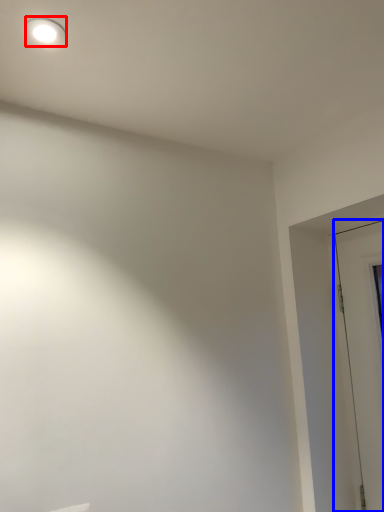
Question: Among these objects, which one is nearest to the camera, lighting (highlighted by a red box) or door (highlighted by a blue box)?

Choices:
 (A) lighting
 (B) door

Answer: (A)